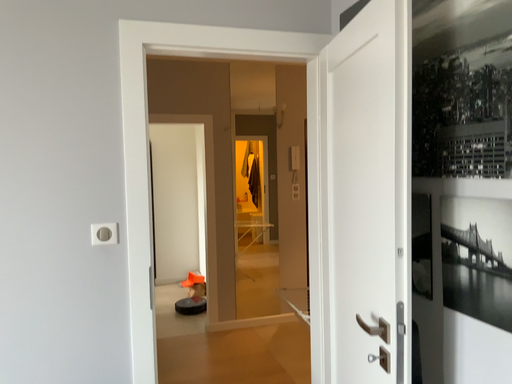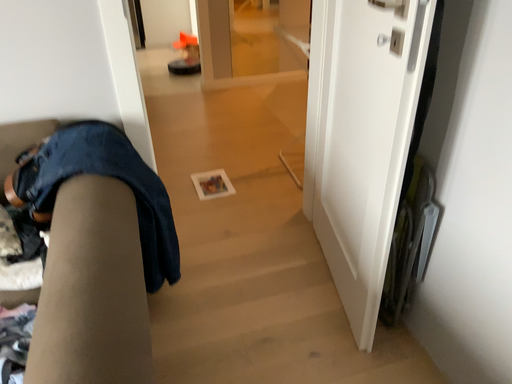
Question: Which way did the camera rotate in the video?

Choices:
 (A) rotated upward
 (B) rotated downward

Answer: (B)